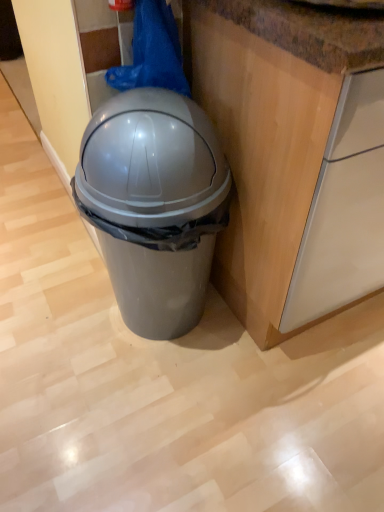
At what (x,y) coordinates should I click in order to perform the action: click on free space that is to the left of matte gray plastic trash can at center. Please return your answer as a coordinate pair (x, y). Image resolution: width=384 pixels, height=512 pixels. Looking at the image, I should click on (55, 345).